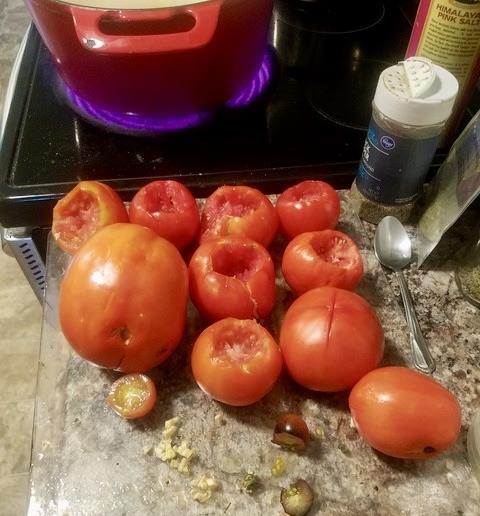
At what (x,y) coordinates should I click in order to perform the action: click on floor. Please return your answer as a coordinate pair (x, y). Looking at the image, I should click on (17, 370).